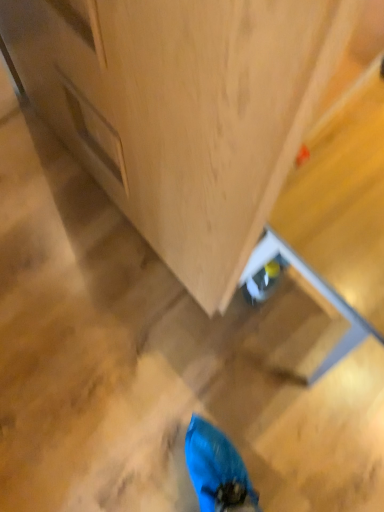
You are a GUI agent. You are given a task and a screenshot of the screen. Output one action in this format:
    pyautogui.click(x=<x>, y=<y>)
    Task: Click on the vacant region to the left of wooden cabinet at lower center
    This screenshot has width=384, height=512.
    Given the screenshot: What is the action you would take?
    pyautogui.click(x=44, y=192)